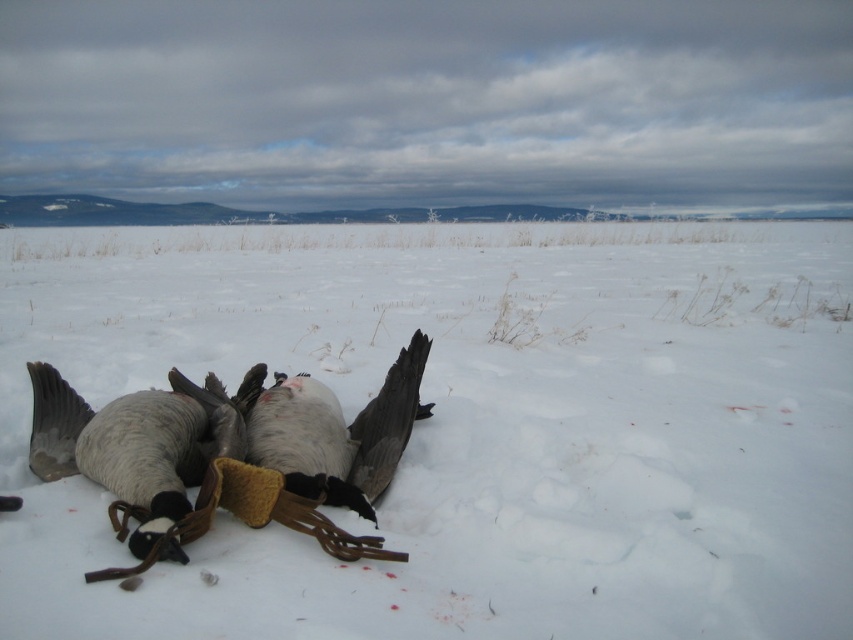
Is gray downy goose at center in front of white down feathered bird at center?

Yes, gray downy goose at center is in front of white down feathered bird at center.

Measure the distance between gray downy goose at center and camera.

gray downy goose at center and camera are 7.10 feet apart.

Describe the element at coordinates (152, 458) in the screenshot. The width and height of the screenshot is (853, 640). I see `gray downy goose at center` at that location.

This screenshot has width=853, height=640. I want to click on gray downy goose at center, so click(x=152, y=458).

From the picture: Is white fluffy snow at center closer to camera compared to gray downy goose at center?

Yes, it is.

Does white fluffy snow at center come behind gray downy goose at center?

That is False.

Does point (157, 250) come closer to viewer compared to point (142, 433)?

No, (157, 250) is behind (142, 433).

The height and width of the screenshot is (640, 853). What are the coordinates of `white fluffy snow at center` in the screenshot? It's located at (466, 426).

Find the location of a particular element. white fluffy snow at center is located at coordinates (466, 426).

Locate an element on the screen. This screenshot has width=853, height=640. white fluffy snow at center is located at coordinates (466, 426).